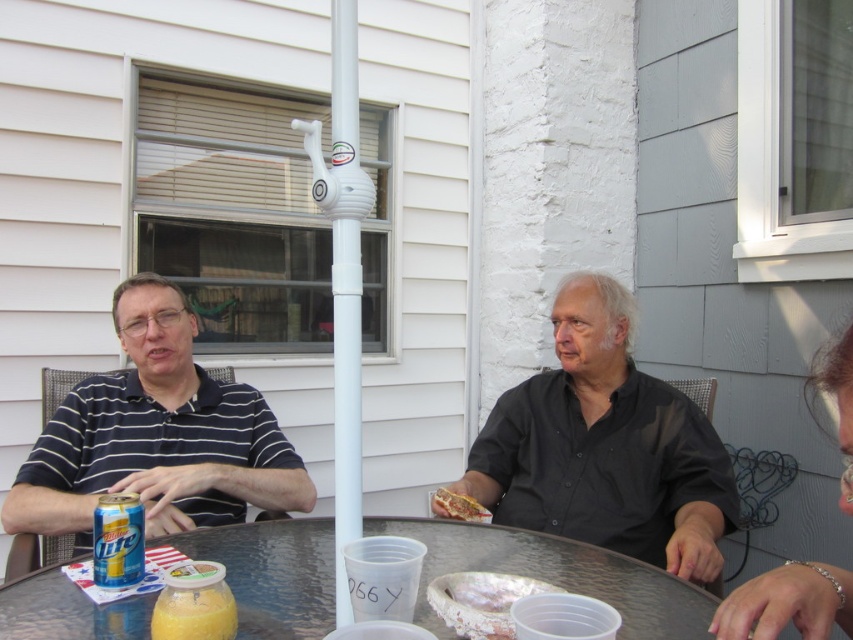
Between yellow metallic can at lower left and shiny silver foil at table center, which one is positioned higher?

yellow metallic can at lower left is above.

Is yellow metallic can at lower left smaller than shiny silver foil at table center?

Yes.

The width and height of the screenshot is (853, 640). What do you see at coordinates (119, 540) in the screenshot?
I see `yellow metallic can at lower left` at bounding box center [119, 540].

Image resolution: width=853 pixels, height=640 pixels. In order to click on yellow metallic can at lower left in this screenshot , I will do `click(119, 540)`.

Is shiny silver bracelet at lower right closer to camera compared to shiny metallic hot dog at center?

Yes, it is in front of shiny metallic hot dog at center.

Who is lower down, shiny silver bracelet at lower right or shiny metallic hot dog at center?

shiny metallic hot dog at center

The width and height of the screenshot is (853, 640). Find the location of `shiny silver bracelet at lower right`. shiny silver bracelet at lower right is located at coordinates (787, 604).

Which is below, translucent plastic table at center or shiny metallic hot dog at center?

translucent plastic table at center is below.

Does translucent plastic table at center have a greater height compared to shiny metallic hot dog at center?

No, translucent plastic table at center is not taller than shiny metallic hot dog at center.

At what (x,y) coordinates should I click in order to perform the action: click on translucent plastic table at center. Please return your answer as a coordinate pair (x, y). This screenshot has width=853, height=640. Looking at the image, I should click on (556, 573).

The image size is (853, 640). I want to click on translucent plastic table at center, so click(x=556, y=573).